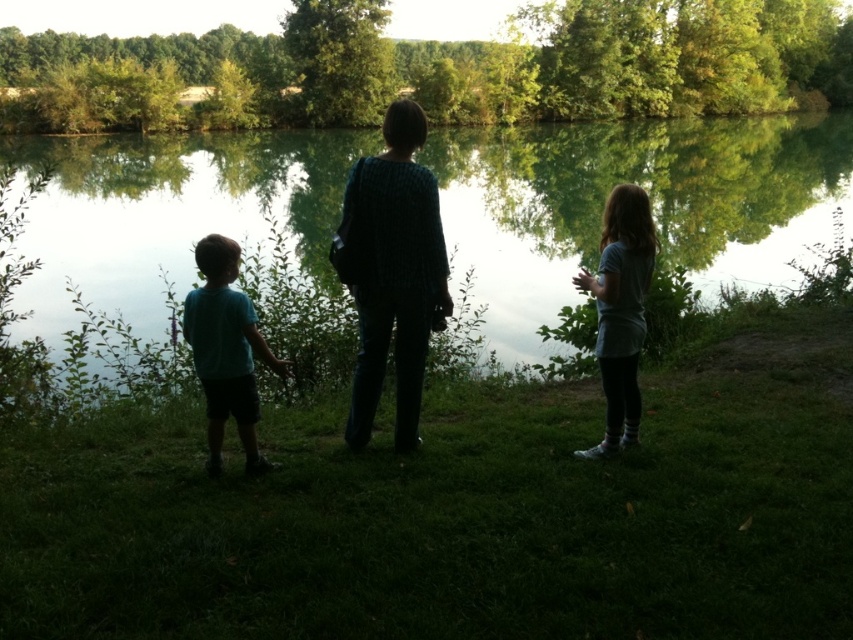
Does green reflective water at center have a greater width compared to matte teal shirt at left?

Correct, the width of green reflective water at center exceeds that of matte teal shirt at left.

Consider the image. Can you confirm if green reflective water at center is positioned below matte teal shirt at left?

Actually, green reflective water at center is above matte teal shirt at left.

The height and width of the screenshot is (640, 853). I want to click on green reflective water at center, so click(650, 198).

Is dark green textured sweater at center positioned before matte teal shirt at left?

No, dark green textured sweater at center is behind matte teal shirt at left.

Is point (369, 358) in front of point (252, 348)?

No, it is behind (252, 348).

In order to click on dark green textured sweater at center in this screenshot , I will do `click(392, 273)`.

Is point (741, 273) closer to viewer compared to point (428, 198)?

No, it is behind (428, 198).

Which is more to the left, green reflective water at center or dark green textured sweater at center?

From the viewer's perspective, green reflective water at center appears more on the left side.

Is point (786, 208) positioned before point (428, 284)?

That is False.

The height and width of the screenshot is (640, 853). I want to click on green reflective water at center, so click(x=650, y=198).